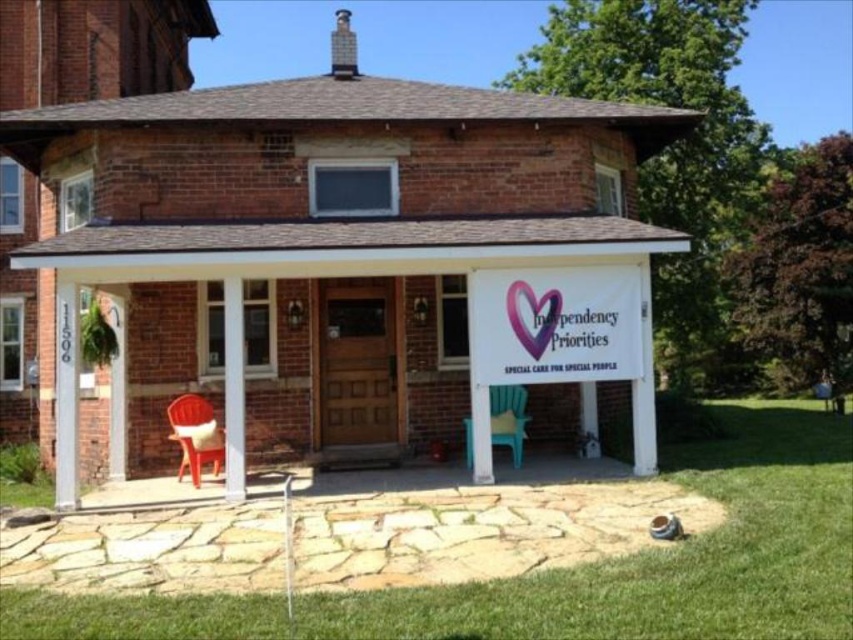
You are standing in front of the house and notice two white objects on the left side of the porch. One is labeled as white painted wood at left and the other is white painted brick pillar at left. Which one is above the other?

The white painted wood at left is positioned over the white painted brick pillar at left, meaning it is above the other.